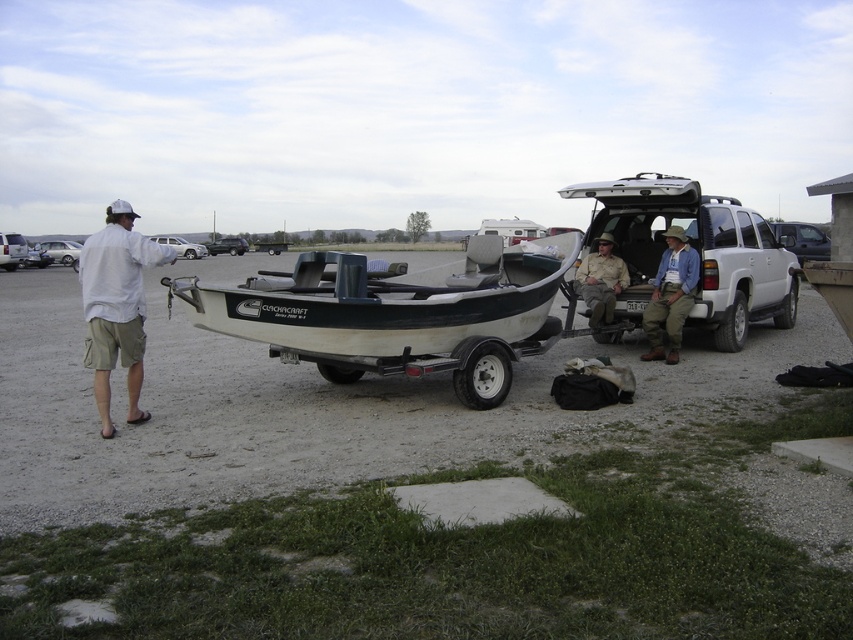
Question: Does khaki pants at center appear under khaki fabric pants at center?

Choices:
 (A) yes
 (B) no

Answer: (A)

Question: Which point is closer to the camera?

Choices:
 (A) (555, 317)
 (B) (158, 250)

Answer: (B)

Question: Is white matte pickup truck at center above khaki pants at center?

Choices:
 (A) yes
 (B) no

Answer: (A)

Question: Does white fiberglass boat at center appear over white cotton shirt at left?

Choices:
 (A) no
 (B) yes

Answer: (B)

Question: Which of the following is the farthest from the observer?

Choices:
 (A) (578, 275)
 (B) (474, 244)
 (C) (126, 244)
 (D) (682, 307)

Answer: (A)

Question: Which object appears farthest from the camera in this image?

Choices:
 (A) khaki pants at center
 (B) white fiberglass boat at center

Answer: (A)